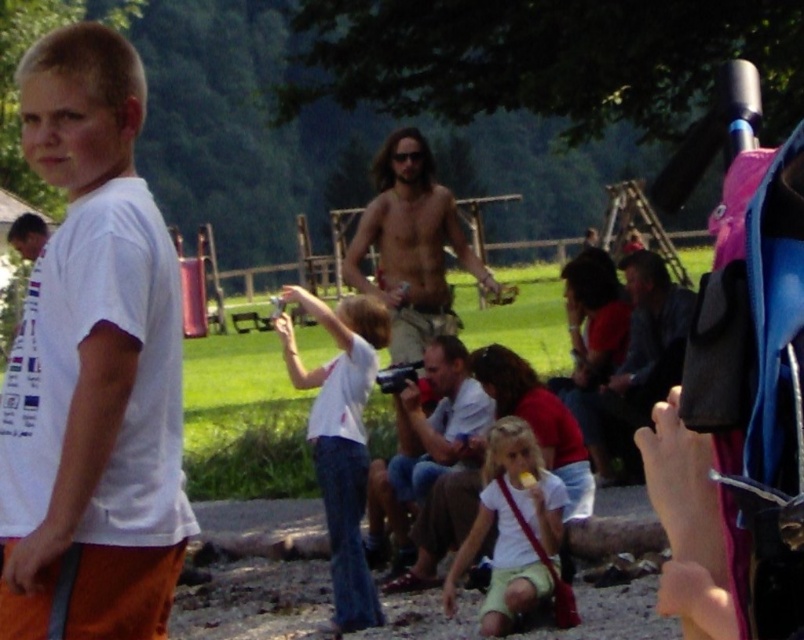
Who is more forward, (x=51, y=33) or (x=386, y=256)?

Point (x=51, y=33) is in front.

From the picture: Who is more distant from viewer, (130, 120) or (442, 237)?

Positioned behind is point (442, 237).

The height and width of the screenshot is (640, 804). What are the coordinates of `white matte t-shirt at left` in the screenshot? It's located at (92, 365).

This screenshot has width=804, height=640. Find the location of `white matte t-shirt at left`. white matte t-shirt at left is located at coordinates (92, 365).

Which of these two, beige textured shorts at center or matte white camera at center, stands taller?

beige textured shorts at center

Between point (374, 198) and point (376, 532), which one is positioned in front?

Point (376, 532) is more forward.

Who is more forward, (384,156) or (458,426)?

Point (458,426) is more forward.

I want to click on beige textured shorts at center, so click(x=411, y=244).

Does matte white camera at center appear on the right side of dark blue jeans at center?

In fact, matte white camera at center is to the left of dark blue jeans at center.

Can you confirm if matte white camera at center is bigger than dark blue jeans at center?

No.

Is point (425, 378) more distant than point (659, 275)?

No, (425, 378) is in front of (659, 275).

The height and width of the screenshot is (640, 804). Find the location of `matte white camera at center`. matte white camera at center is located at coordinates (425, 445).